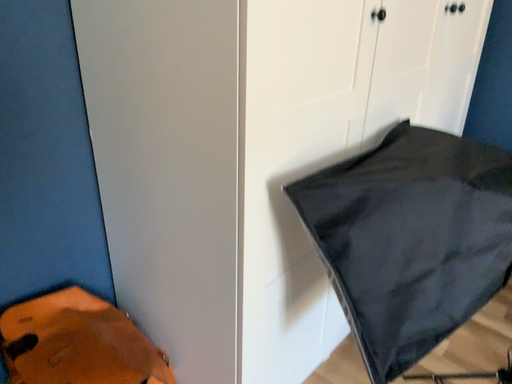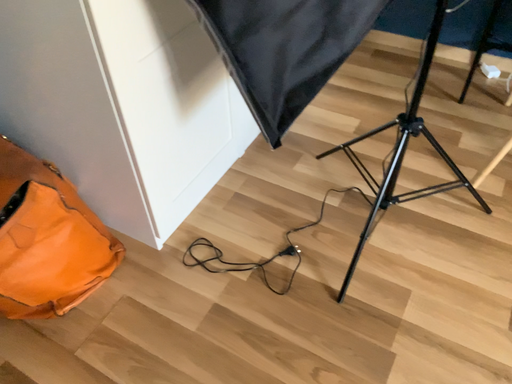
Question: How did the camera likely rotate when shooting the video?

Choices:
 (A) rotated right
 (B) rotated left

Answer: (A)